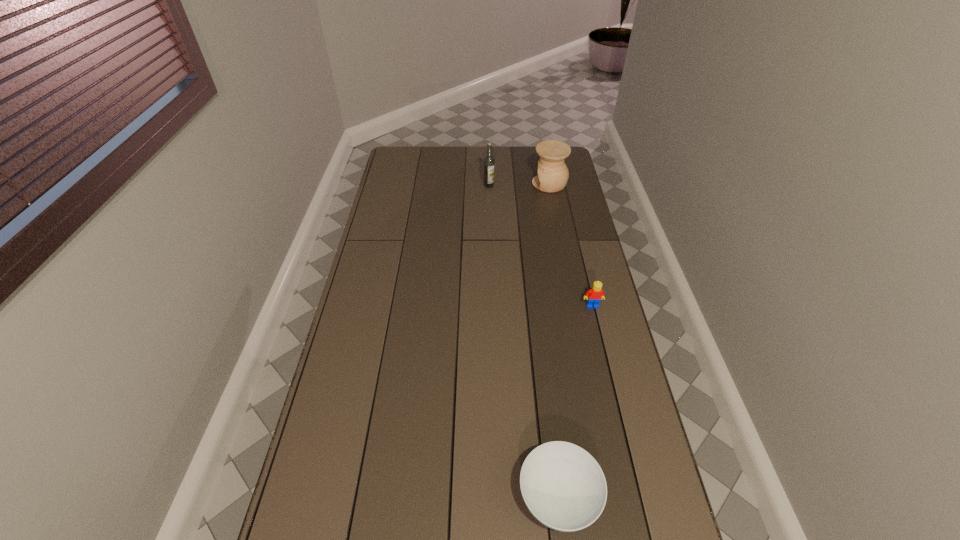
Locate an element on the screen. Image resolution: width=960 pixels, height=540 pixels. Lego that is at the right edge is located at coordinates (594, 295).

Identify the location of vacant space at the left edge. The height and width of the screenshot is (540, 960). (384, 245).

This screenshot has height=540, width=960. In the image, there is a desktop. Identify the location of vacant space at the right edge. (600, 376).

This screenshot has width=960, height=540. I want to click on unoccupied position between the pottery and the third farthest object, so click(x=571, y=245).

You are a GUI agent. You are given a task and a screenshot of the screen. Output one action in this format:
    pyautogui.click(x=<x>, y=<y>)
    Task: Click on the free space between the pottery and the Lego
    This screenshot has height=540, width=960.
    Given the screenshot: What is the action you would take?
    pyautogui.click(x=571, y=245)

Find the location of a particular element. The width and height of the screenshot is (960, 540). free space between the Lego and the pottery is located at coordinates (571, 245).

What are the coordinates of `free area in between the second tallest object and the leftmost object` in the screenshot? It's located at (519, 185).

The image size is (960, 540). I want to click on unoccupied area between the Lego and the pottery, so click(571, 245).

The height and width of the screenshot is (540, 960). I want to click on vacant space in between the second nearest object and the tallest object, so click(540, 246).

Identify which object is the nearest to the Lego. Please provide its 2D coordinates. Your answer should be formatted as a tuple, i.e. [(x, y)], where the tuple contains the x and y coordinates of a point satisfying the conditions above.

[(563, 486)]